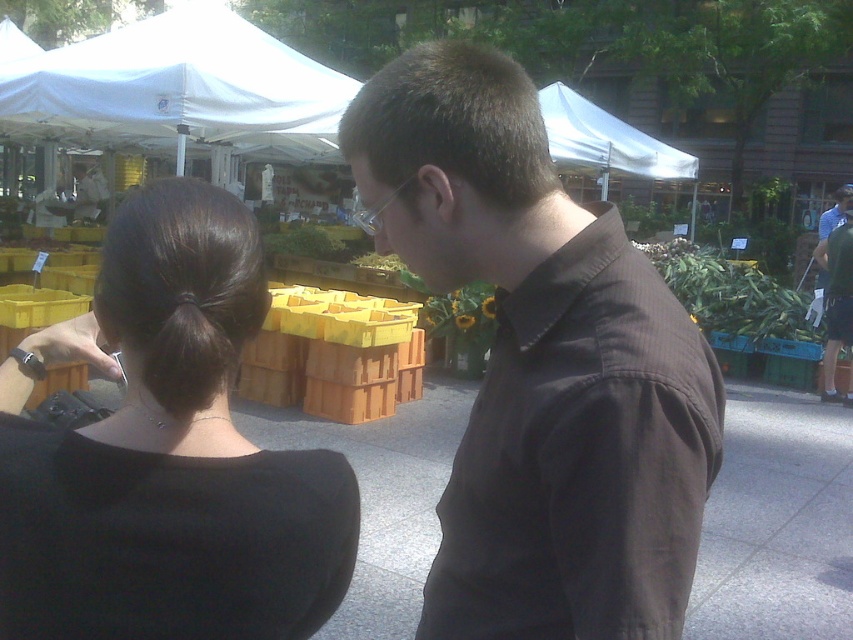
Is green leafy produce at center further to camera compared to dark green t-shirt at right?

Yes, green leafy produce at center is behind dark green t-shirt at right.

Can you confirm if green leafy produce at center is positioned to the right of dark green t-shirt at right?

In fact, green leafy produce at center is to the left of dark green t-shirt at right.

Find the location of a particular element. The image size is (853, 640). green leafy produce at center is located at coordinates (730, 292).

Who is higher up, black fabric shirt at upper left or white fabric canopy at upper center?

white fabric canopy at upper center is higher up.

Locate an element on the screen. The image size is (853, 640). black fabric shirt at upper left is located at coordinates (166, 454).

Is black fabric shirt at upper left wider than green leafy produce at center?

No, black fabric shirt at upper left is not wider than green leafy produce at center.

Can you confirm if black fabric shirt at upper left is positioned to the right of green leafy produce at center?

In fact, black fabric shirt at upper left is to the left of green leafy produce at center.

Between point (6, 548) and point (769, 276), which one is positioned in front?

Point (6, 548) is in front.

Where is `black fabric shirt at upper left`? Image resolution: width=853 pixels, height=640 pixels. black fabric shirt at upper left is located at coordinates (166, 454).